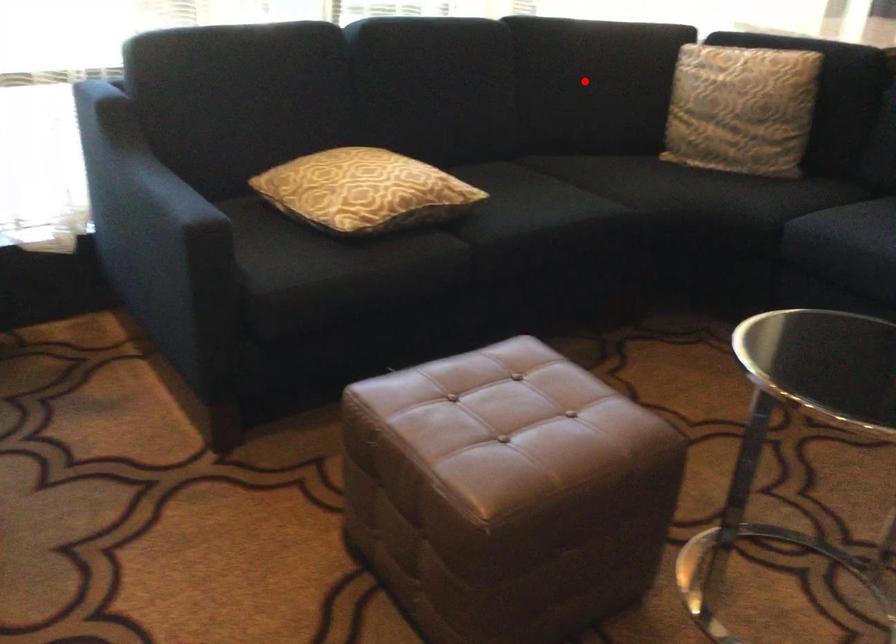
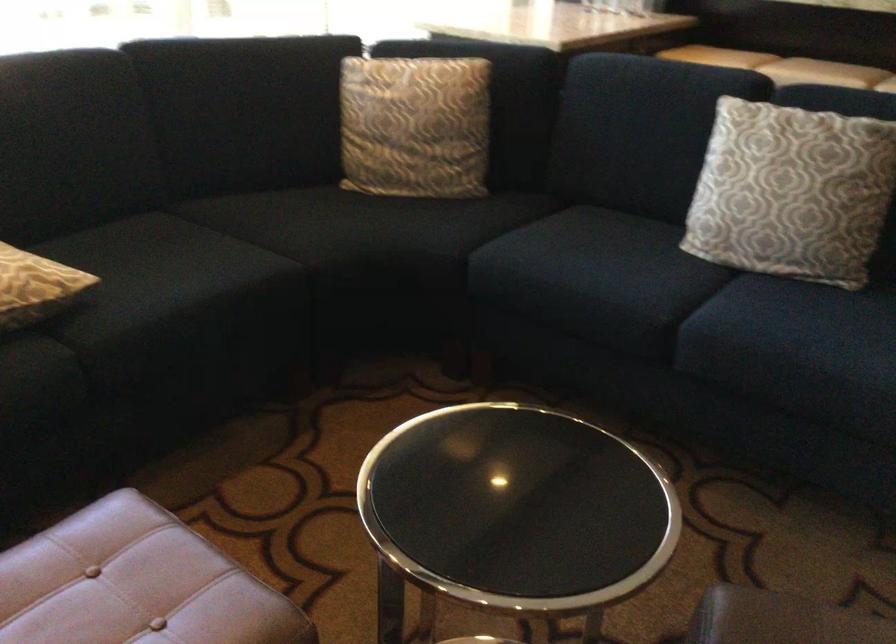
Where in the second image is the point corresponding to the highlighted location from the first image?

(238, 111)